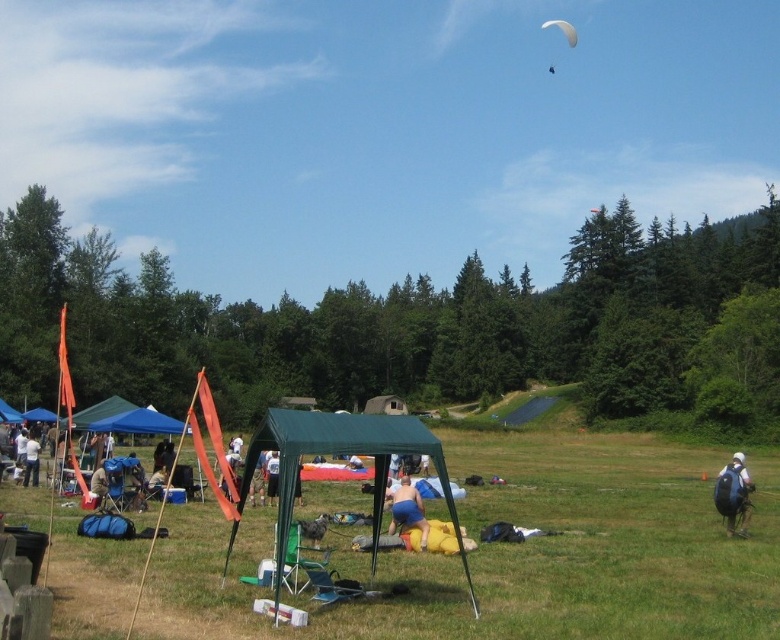
You are standing at the edge of the field and want to set up a new tent between the green fabric tent at center and the blue fabric tent at center. Based on their positions, which tent should you place your new tent closer to in order to be between them?

The green fabric tent at center is located above the blue fabric tent at center, so to place your new tent between them, you should position it closer to the blue fabric tent at center since it is below the green one.

You are planning to set up a picnic blanket. You have a blue fabric at center and a green fabric tent at center. Which object should you move to access the area where you want to place your picnic blanket?

The green fabric tent at center is to the left of blue fabric at center. To access the area where you want to place your picnic blanket, you should move the green fabric tent at center to the right or the blue fabric at center to the left.